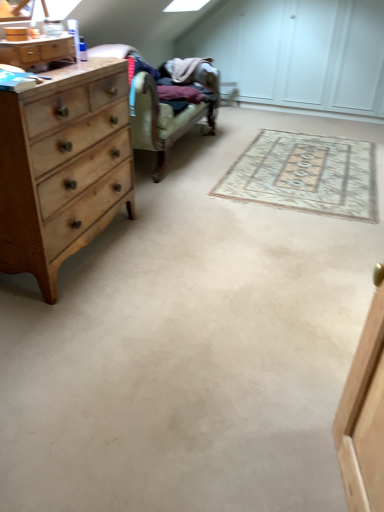
Find the location of a particular element. The image size is (384, 512). unoccupied area in front of light brown wood chest of drawers at left is located at coordinates (91, 330).